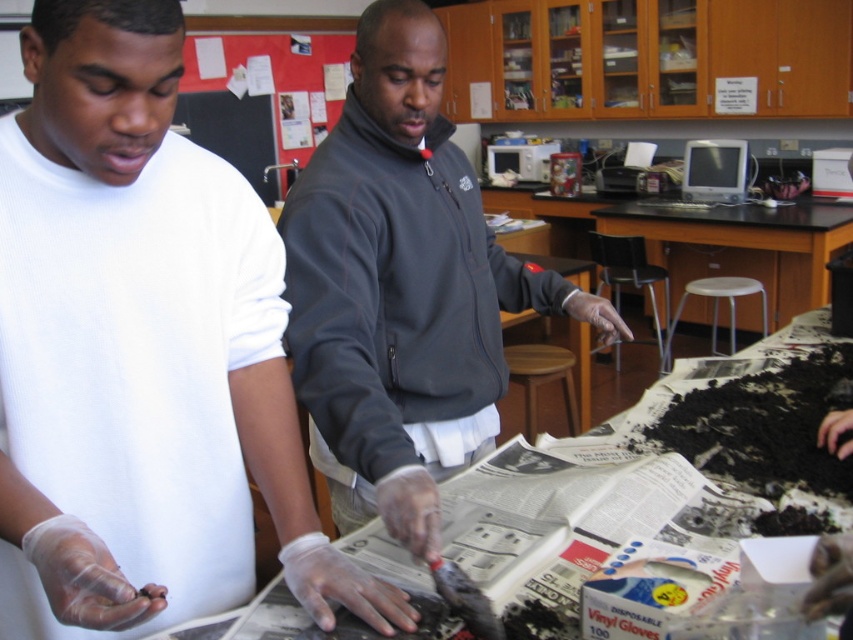
You are standing in the laboratory scene. There are two points marked in the image. The first point is at coordinates point (503, 516) and the second is at point (688, 253). If you were to walk from the first point to the second point, would you be moving towards the background or the foreground of the image?

Moving from point (503, 516) to point (688, 253) would mean moving towards the background of the image because point (503, 516) is in front of point (688, 253).

You are a researcher in the lab and need to record data. Where is the white paper at center located in the coordinate system of the image?

The white paper at center is located at point coordinates of (577,520).